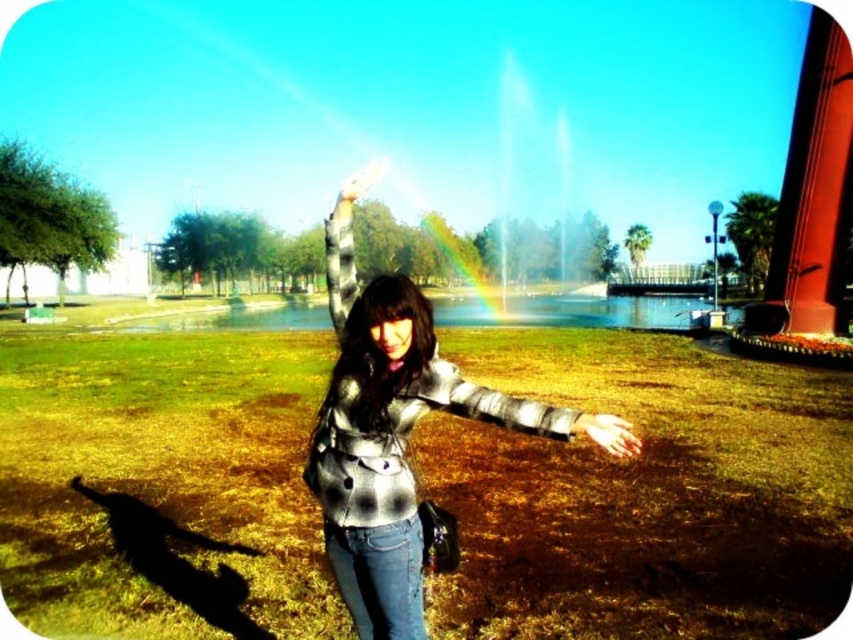
You are standing at the point labeled point (576, 432) and want to walk to the point labeled point (380, 176). Which direction should you face to walk directly towards your destination?

You should face towards the point (380, 176), which is further away from the viewer compared to point (576, 432). Since point (380, 176) is farther, you need to walk in the direction away from the viewer to reach it.

Looking at the scene, which hand is positioned to the right between the smooth skin hand at lower center and the matte black hand at center?

The smooth skin hand at lower center is positioned to the right of the matte black hand at center.